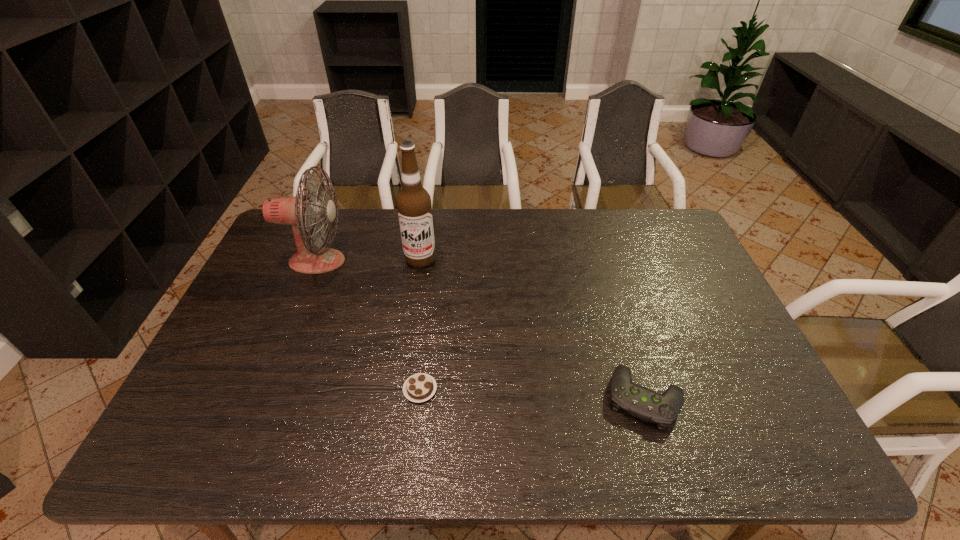
Find the location of a particular element. The width and height of the screenshot is (960, 540). free location that satisfies the following two spatial constraints: 1. on the back side of the shortest object; 2. in front of the leftmost object to direct airflow is located at coordinates (435, 261).